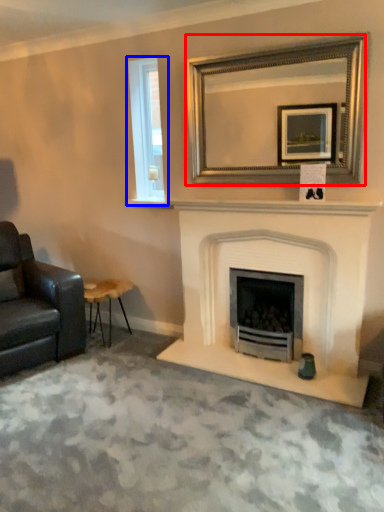
Question: Among these objects, which one is nearest to the camera, mirror (highlighted by a red box) or window (highlighted by a blue box)?

Choices:
 (A) mirror
 (B) window

Answer: (A)